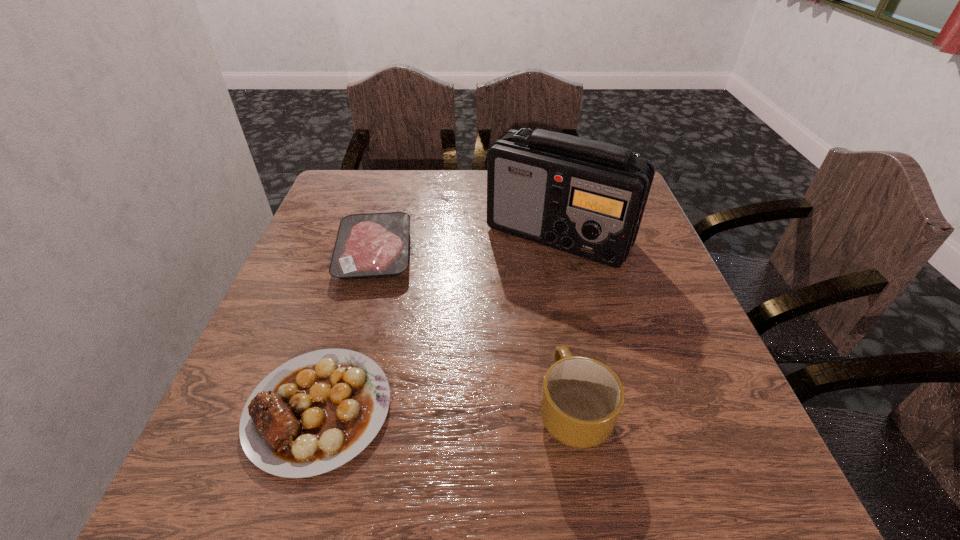
The width and height of the screenshot is (960, 540). Find the location of `the tallest object`. the tallest object is located at coordinates (584, 197).

You are a GUI agent. You are given a task and a screenshot of the screen. Output one action in this format:
    pyautogui.click(x=<x>, y=<y>)
    Task: Click on the mug
    This screenshot has width=960, height=540.
    Given the screenshot: What is the action you would take?
    (x=581, y=399)

The image size is (960, 540). Find the location of `the nearer steak`. the nearer steak is located at coordinates (314, 413).

Find the location of a particular element. the third tallest object is located at coordinates (314, 413).

This screenshot has width=960, height=540. Identify the location of the shorter steak. (376, 245).

You are a GUI agent. You are given a task and a screenshot of the screen. Output one action in this format:
    pyautogui.click(x=<x>, y=<y>)
    Task: Click on the farther steak
    The image size is (960, 540).
    Given the screenshot: What is the action you would take?
    pyautogui.click(x=376, y=245)

Locate an element on the screen. The image size is (960, 540). vacant space located 0.300m on the front panel of the radio receiver is located at coordinates (592, 386).

Locate an element on the screen. The image size is (960, 540). free space located on the side with the handle of the mug is located at coordinates (543, 243).

The height and width of the screenshot is (540, 960). I want to click on vacant space located 0.340m on the side with the handle of the mug, so click(x=545, y=251).

I want to click on vacant region located 0.270m on the side with the handle of the mug, so click(x=548, y=270).